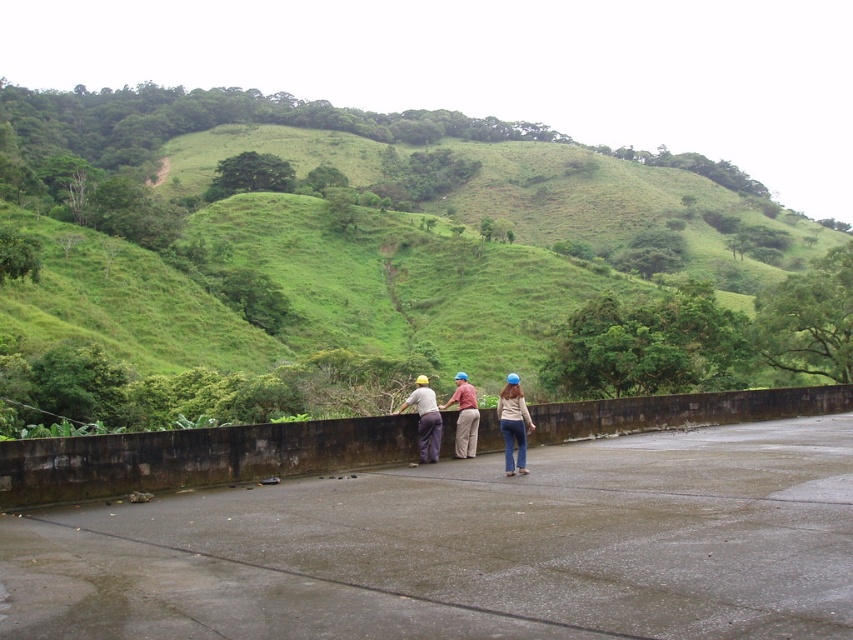
You are standing on the concrete platform overlooking the hillside. There are two points marked on the platform. Which point is closer to you, point (57,412) or point (419,387)?

Point (57,412) is closer to you because it is further to the viewer than point (419,387).

You are a hiker planning to walk from the denim jacket at center to the green grassy hillside at upper center. Given that the distance between them is 177.18 meters, and your walking speed is 3 km per hour, how many minutes will it take you to reach the hillside?

The distance between the denim jacket at center and the green grassy hillside at upper center is 177.18 meters. Converting meters to kilometers, 177.18 meters equals 0.17718 kilometers. At a walking speed of 3 km per hour, the time required is 0.17718 km divided by 3 km per hour, which equals approximately 0.059 hours. Converting hours to minutes by multiplying by 60 gives roughly 3.54 minutes. Therefore, it will take approximately 3.5 minutes to reach the green grassy hillside at upper center.